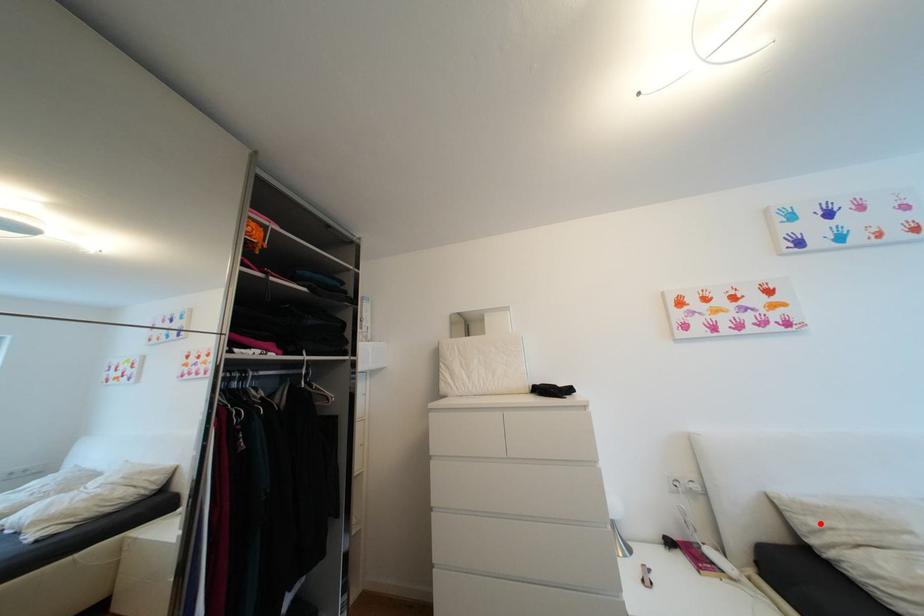
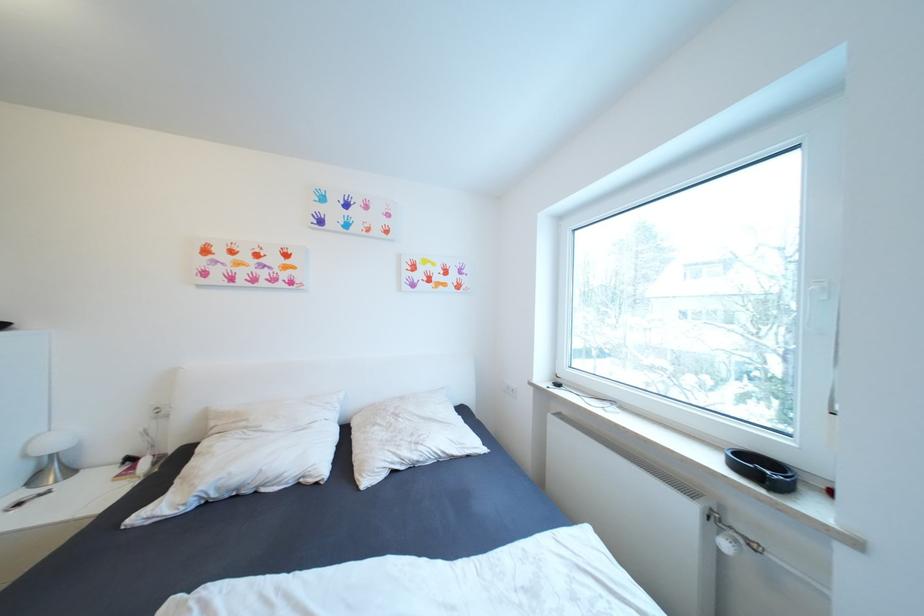
The point at the highlighted location is marked in the first image. Where is the corresponding point in the second image?

(220, 424)